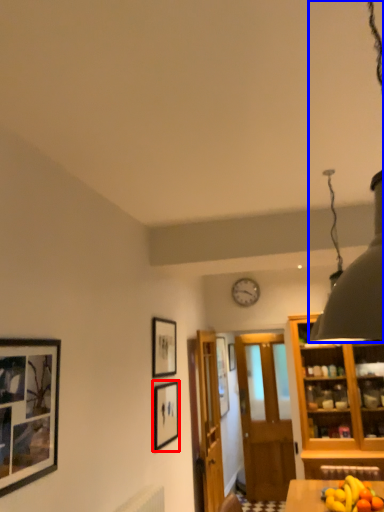
Question: Which of the following is the farthest to the observer, picture frame (highlighted by a red box) or light fixture (highlighted by a blue box)?

Choices:
 (A) picture frame
 (B) light fixture

Answer: (A)